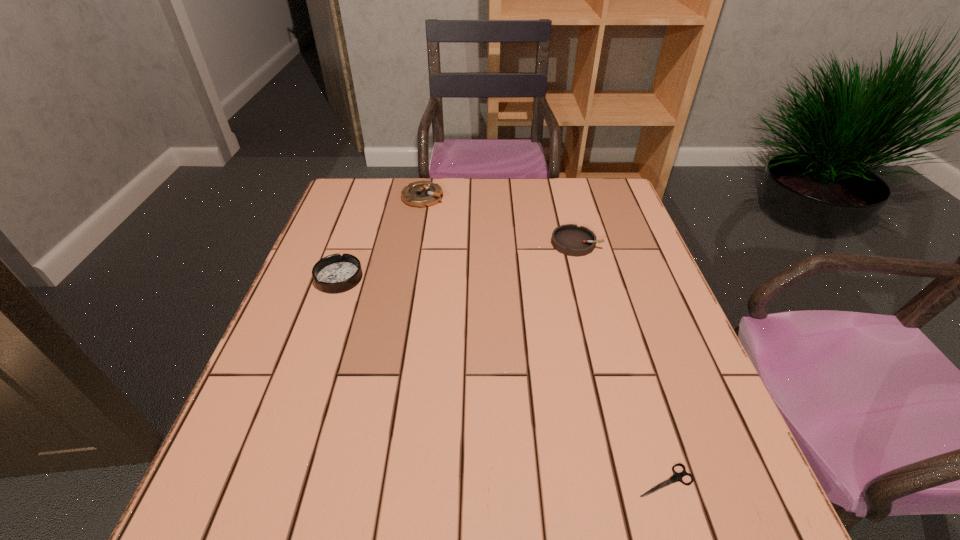
At what (x,y) coordinates should I click in order to perform the action: click on the farthest ashtray. Please return your answer as a coordinate pair (x, y). Image resolution: width=960 pixels, height=540 pixels. Looking at the image, I should click on (420, 194).

You are a GUI agent. You are given a task and a screenshot of the screen. Output one action in this format:
    pyautogui.click(x=<x>, y=<y>)
    Task: Click on the second object from left to right
    The width and height of the screenshot is (960, 540).
    Given the screenshot: What is the action you would take?
    pyautogui.click(x=420, y=194)

This screenshot has height=540, width=960. In order to click on the rightmost ashtray in this screenshot , I will do `click(569, 239)`.

At what (x,y) coordinates should I click in order to perform the action: click on the third nearest object. Please return your answer as a coordinate pair (x, y). The image size is (960, 540). Looking at the image, I should click on (569, 239).

This screenshot has height=540, width=960. Identify the location of the leftmost ashtray. (335, 273).

At what (x,y) coordinates should I click in order to perform the action: click on the leftmost object. Please return your answer as a coordinate pair (x, y). Looking at the image, I should click on (335, 273).

Where is `shears`? The height and width of the screenshot is (540, 960). shears is located at coordinates (676, 476).

Where is `the nearest object`? the nearest object is located at coordinates (676, 476).

Image resolution: width=960 pixels, height=540 pixels. Identify the location of free space located 0.360m on the right of the farthest object. (x=559, y=197).

Image resolution: width=960 pixels, height=540 pixels. In order to click on free location located 0.050m on the right of the second farthest object in this screenshot , I will do `click(618, 243)`.